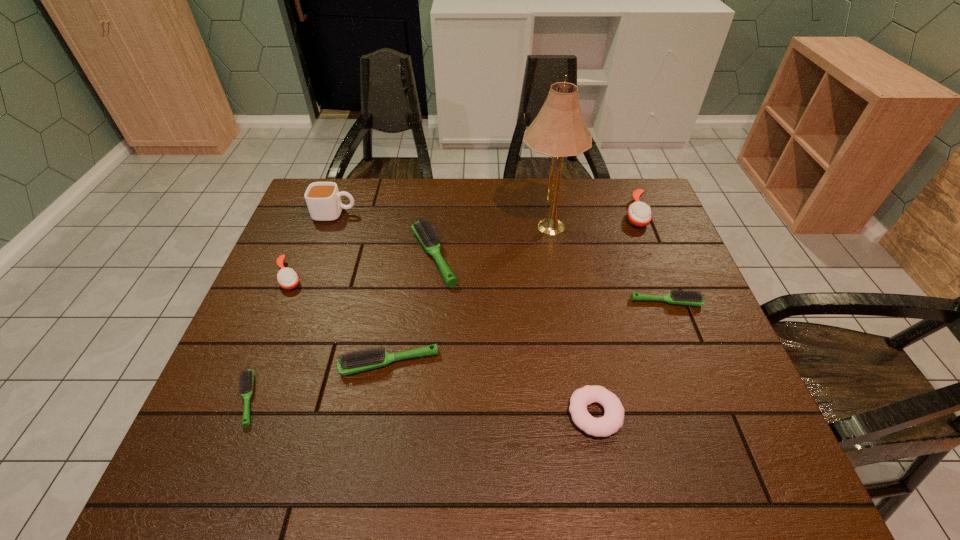
Point out which hairbrush is positioned as the fifth nearest to the biggest light hairbrush. Please provide its 2D coordinates. Your answer should be formatted as a tuple, i.e. [(x, y)], where the tuple contains the x and y coordinates of a point satisfying the conditions above.

[(639, 214)]

I want to click on light hairbrush that stands as the fourth closest to the tallest object, so click(246, 382).

You are a GUI agent. You are given a task and a screenshot of the screen. Output one action in this format:
    pyautogui.click(x=<x>, y=<y>)
    Task: Click on the closest light hairbrush relative to the second shortest hairbrush
    The image size is (960, 540).
    Given the screenshot: What is the action you would take?
    pyautogui.click(x=427, y=235)

You are a GUI agent. You are given a task and a screenshot of the screen. Output one action in this format:
    pyautogui.click(x=<x>, y=<y>)
    Task: Click on the vacant region that satisfies the following two spatial constraints: 1. on the side with the handle of the cup; 2. on the front side of the left orange hairbrush
    The width and height of the screenshot is (960, 540).
    Given the screenshot: What is the action you would take?
    pyautogui.click(x=312, y=276)

At what (x,y) coordinates should I click in order to perform the action: click on vacant space that satisfies the following two spatial constraints: 1. on the side with the handle of the cup; 2. on the left side of the doughnut. Please return your answer as a coordinate pair (x, y). Looking at the image, I should click on (262, 414).

You are a GUI agent. You are given a task and a screenshot of the screen. Output one action in this format:
    pyautogui.click(x=<x>, y=<y>)
    Task: Click on the blank area in the image that satisfies the following two spatial constraints: 1. on the side with the handle of the second tallest object; 2. on the back side of the third biggest light hairbrush
    The width and height of the screenshot is (960, 540).
    Given the screenshot: What is the action you would take?
    pyautogui.click(x=302, y=302)